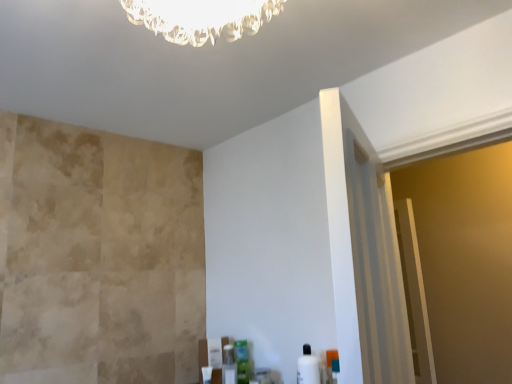
Question: Can you confirm if white glossy bottle at lower right, the 1th toiletry positioned from the front, is taller than clear plastic bottle at lower center, the 3th toiletry when ordered from front to back?

Choices:
 (A) no
 (B) yes

Answer: (B)

Question: Is white glossy bottle at lower right, the 1th toiletry positioned from the front, bigger than clear plastic bottle at lower center, the third toiletry viewed from the right?

Choices:
 (A) no
 (B) yes

Answer: (B)

Question: From a real-world perspective, is white glossy bottle at lower right, the third toiletry in the left-to-right sequence, on clear plastic bottle at lower center, the 3th toiletry when ordered from front to back?

Choices:
 (A) yes
 (B) no

Answer: (A)

Question: Considering the relative sizes of white glossy bottle at lower right, the third toiletry in the left-to-right sequence, and clear plastic bottle at lower center, the first toiletry in the left-to-right sequence, in the image provided, is white glossy bottle at lower right, the third toiletry in the left-to-right sequence, thinner than clear plastic bottle at lower center, the first toiletry in the left-to-right sequence,?

Choices:
 (A) yes
 (B) no

Answer: (B)

Question: From the image's perspective, is white glossy bottle at lower right, the 1th toiletry positioned from the front, on top of clear plastic bottle at lower center, the first toiletry in the left-to-right sequence?

Choices:
 (A) yes
 (B) no

Answer: (A)

Question: Is green plastic container at lower center, which is the second toiletry from left to right, to the left or to the right of clear plastic bottle at lower center, the third toiletry viewed from the right, in the image?

Choices:
 (A) left
 (B) right

Answer: (B)

Question: From the image's perspective, is green plastic container at lower center, the 2th toiletry positioned from the front, located above or below clear plastic bottle at lower center, the third toiletry viewed from the right?

Choices:
 (A) below
 (B) above

Answer: (B)

Question: From a real-world perspective, is green plastic container at lower center, the 2th toiletry positioned from the front, above or below clear plastic bottle at lower center, the first toiletry viewed from the back?

Choices:
 (A) below
 (B) above

Answer: (B)

Question: Considering the positions of green plastic container at lower center, placed as the 2th toiletry when sorted from back to front, and clear plastic bottle at lower center, the 3th toiletry when ordered from front to back, in the image, is green plastic container at lower center, placed as the 2th toiletry when sorted from back to front, bigger or smaller than clear plastic bottle at lower center, the 3th toiletry when ordered from front to back,?

Choices:
 (A) small
 (B) big

Answer: (B)

Question: From the image's perspective, relative to white glossy bottle at lower right, which ranks as the 3th toiletry in back-to-front order, is green plastic container at lower center, which is the second toiletry from left to right, above or below?

Choices:
 (A) below
 (B) above

Answer: (A)

Question: Does point (243, 375) appear closer or farther from the camera than point (297, 382)?

Choices:
 (A) closer
 (B) farther

Answer: (B)

Question: Considering their positions, is green plastic container at lower center, the 2th toiletry positioned from the front, located in front of or behind white glossy bottle at lower right, which ranks as the 3th toiletry in back-to-front order?

Choices:
 (A) behind
 (B) front

Answer: (A)

Question: Considering the positions of green plastic container at lower center, the 2th toiletry positioned from the front, and white glossy bottle at lower right, the 1th toiletry positioned from the front, in the image, is green plastic container at lower center, the 2th toiletry positioned from the front, taller or shorter than white glossy bottle at lower right, the 1th toiletry positioned from the front,?

Choices:
 (A) short
 (B) tall

Answer: (A)

Question: Is white glossy bottle at lower right, which ranks as the 3th toiletry in back-to-front order, in front of or behind green plastic container at lower center, placed as the 2th toiletry when sorted from back to front, in the image?

Choices:
 (A) front
 (B) behind

Answer: (A)

Question: In terms of width, does white glossy bottle at lower right, the third toiletry in the left-to-right sequence, look wider or thinner when compared to green plastic container at lower center, which is the second toiletry from left to right?

Choices:
 (A) thin
 (B) wide

Answer: (B)